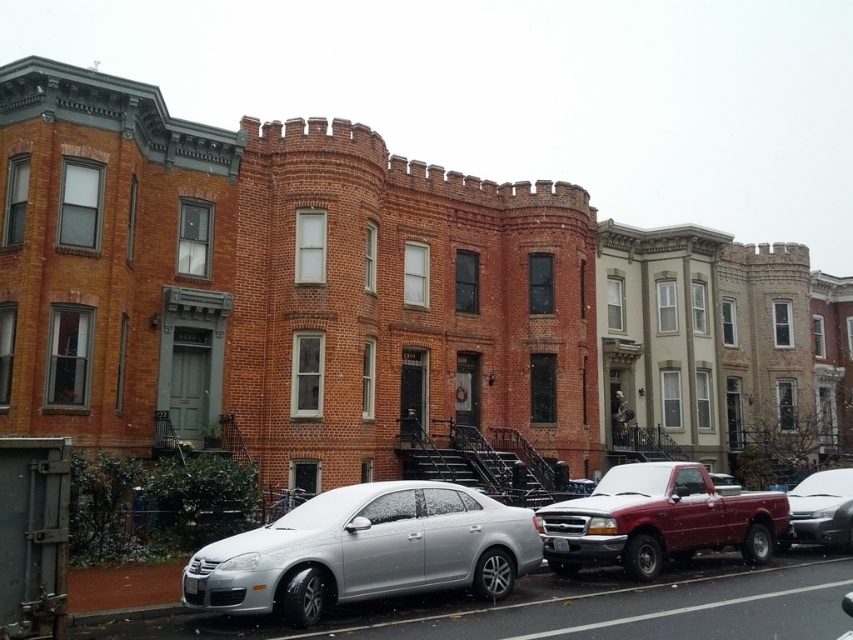
Question: Is satin silver sedan at lower left positioned before silver metallic sedan at center?

Choices:
 (A) yes
 (B) no

Answer: (A)

Question: Which point appears farthest from the camera in this image?

Choices:
 (A) (579, 566)
 (B) (798, 484)
 (C) (347, 564)

Answer: (B)

Question: Among these objects, which one is farthest from the camera?

Choices:
 (A) shiny red pickup truck at center
 (B) silver metallic sedan at center

Answer: (B)

Question: Observing the image, what is the correct spatial positioning of satin silver sedan at lower left in reference to silver metallic sedan at center?

Choices:
 (A) right
 (B) left

Answer: (B)

Question: Which object appears farthest from the camera in this image?

Choices:
 (A) satin silver sedan at lower left
 (B) shiny red pickup truck at center
 (C) silver metallic sedan at center

Answer: (C)

Question: Is satin silver sedan at lower left wider than silver metallic sedan at center?

Choices:
 (A) yes
 (B) no

Answer: (A)